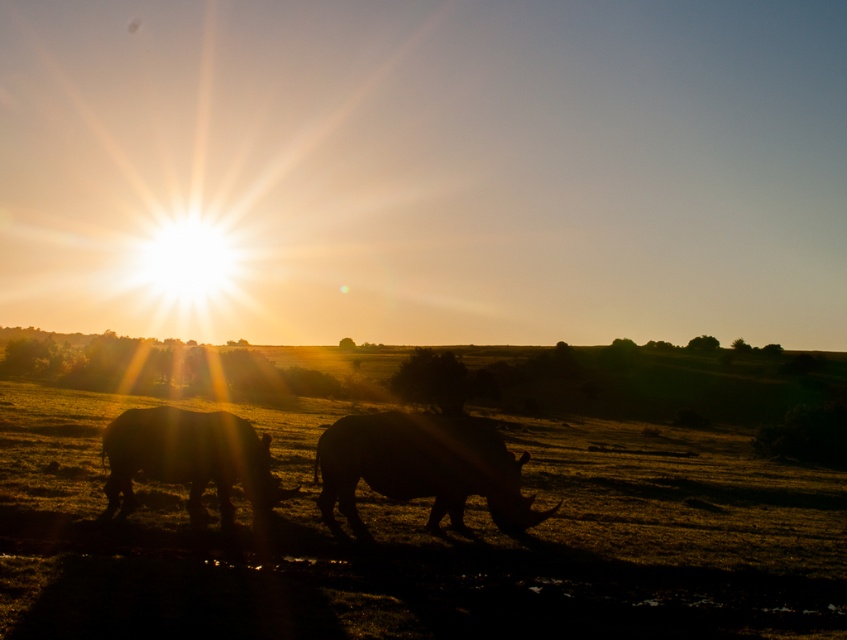
Who is taller, silhouette horned at center or silhouette horned animal at center?

silhouette horned at center is taller.

Is silhouette horned at center below silhouette horned animal at center?

Yes, silhouette horned at center is below silhouette horned animal at center.

Identify the location of silhouette horned at center. Image resolution: width=847 pixels, height=640 pixels. (422, 467).